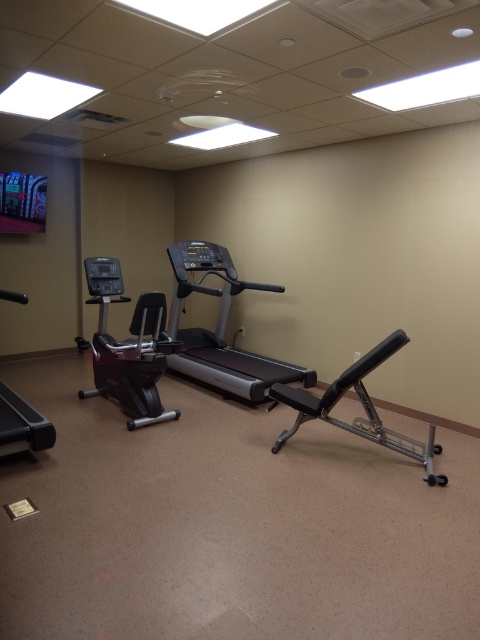
You are in a gym and need to move from the black rubber treadmill at left to the silver metallic treadmill at center. Which direction should you move in?

You should move to the right to reach the silver metallic treadmill at center from the black rubber treadmill at left since the silver metallic treadmill at center is positioned to the right of the black rubber treadmill at left.

You are standing at the entrance of the gym and want to place a new exercise mat. The mat is 1.5 meters long. There is a point marked at coordinates point [362,406] which is the location of the silver metallic weight bench at center. Can you place the mat horizontally in front of the entrance without overlapping the weight bench?

The point [362,406] indicates the silver metallic weight bench at center. Since the mat is 1.5 meters long and needs to be placed horizontally in front of the entrance, you must ensure that the area from the entrance to the weight bench is at least 1.5 meters. However, without knowing the exact distance between the entrance and the weight bench, it is impossible to determine if the mat will fit without overlapping. Please check the available space.